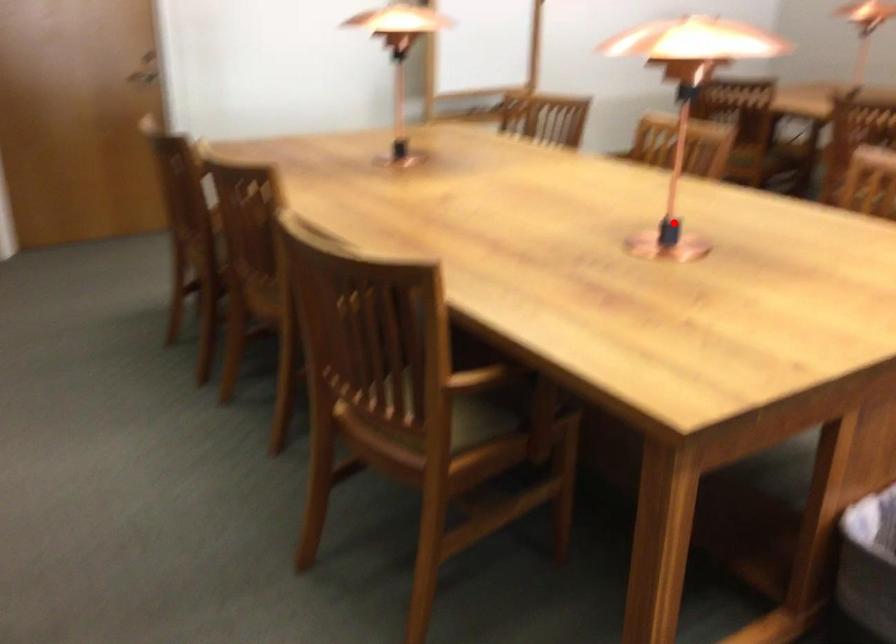
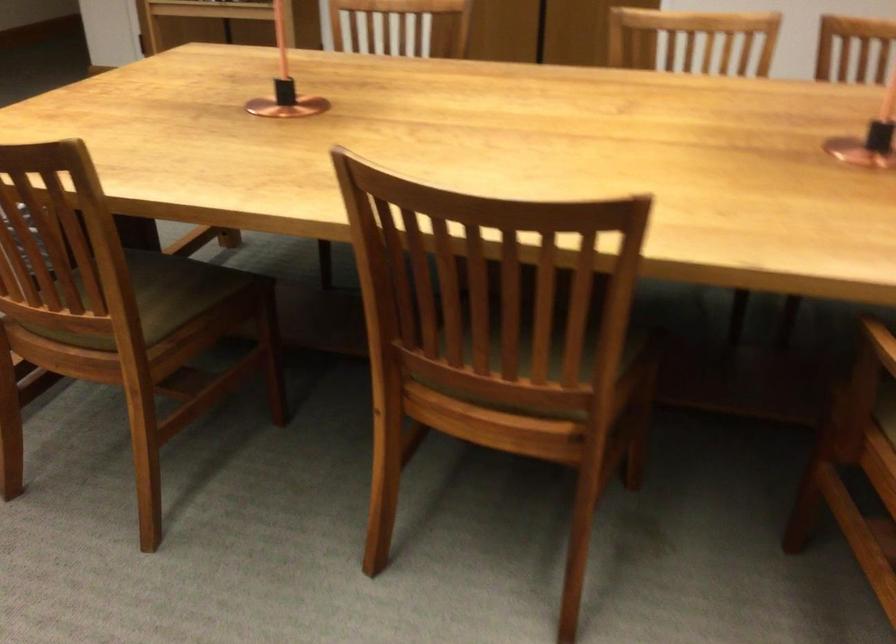
Locate, in the second image, the point that corresponds to the highlighted location in the first image.

(285, 84)